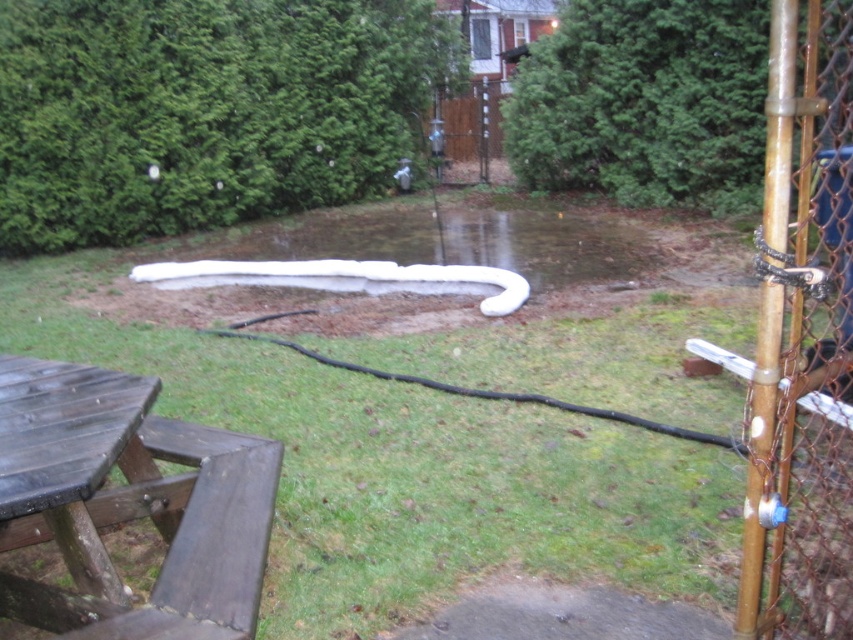
Which is more to the left, dark brown wood picnic table at lower left or rusty chain-link fence at right?

From the viewer's perspective, dark brown wood picnic table at lower left appears more on the left side.

Which of these two, dark brown wood picnic table at lower left or rusty chain-link fence at right, stands taller?

rusty chain-link fence at right

Identify the location of dark brown wood picnic table at lower left. The height and width of the screenshot is (640, 853). (128, 504).